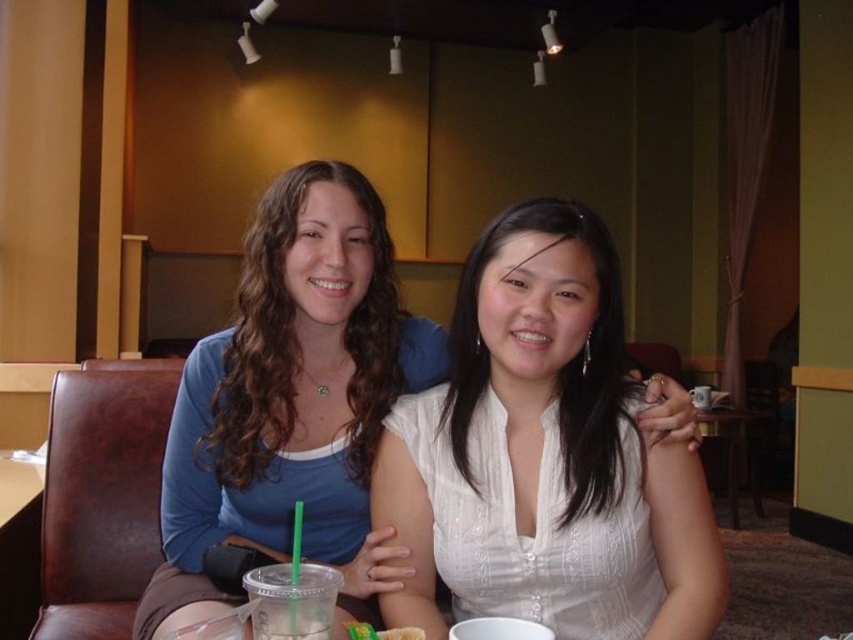
Question: Is white satin blouse at center to the left of wooden table at center from the viewer's perspective?

Choices:
 (A) no
 (B) yes

Answer: (B)

Question: Which point is farther to the camera?

Choices:
 (A) white satin blouse at center
 (B) wooden table at center
 (C) clear plastic cup at center

Answer: (B)

Question: Is white satin blouse at center positioned in front of wooden table at center?

Choices:
 (A) no
 (B) yes

Answer: (B)

Question: Among these objects, which one is nearest to the camera?

Choices:
 (A) green matte bread at center
 (B) wooden table at center
 (C) clear plastic cup at center

Answer: (C)

Question: Does clear plastic cup at center have a greater width compared to wooden table at center?

Choices:
 (A) yes
 (B) no

Answer: (B)

Question: Which point is farther to the camera?

Choices:
 (A) 554,346
 (B) 376,637

Answer: (A)